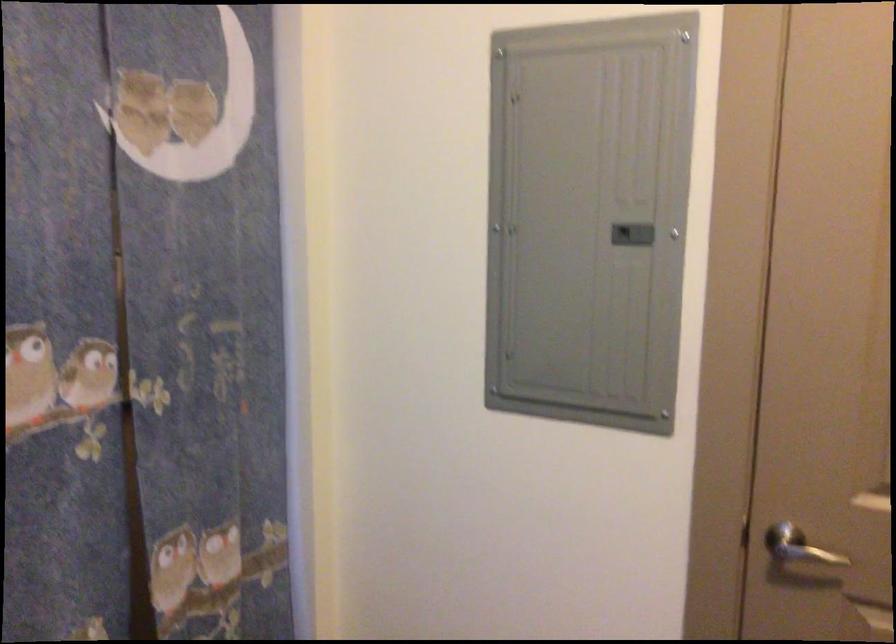
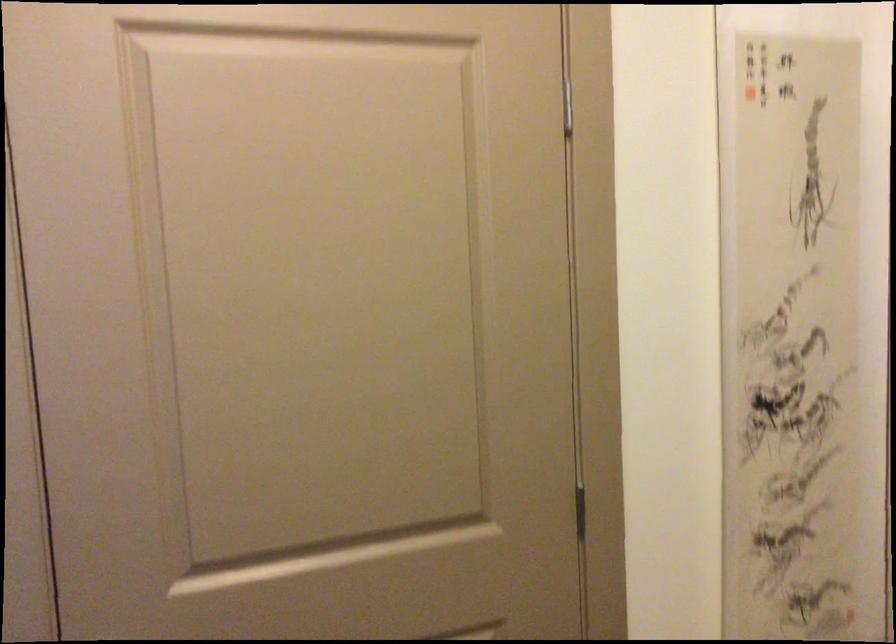
Question: The first image is from the beginning of the video and the second image is from the end. How did the camera likely rotate when shooting the video?

Choices:
 (A) Left
 (B) Right
 (C) Up
 (D) Down

Answer: (B)